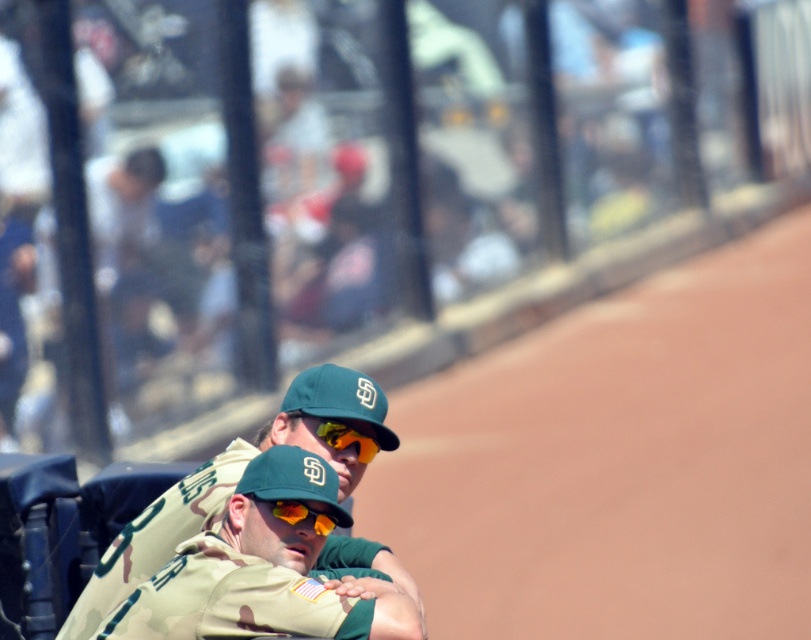
Question: Which object appears farthest from the camera in this image?

Choices:
 (A) camouflage uniform at center
 (B) shiny orange plastic goggles at center

Answer: (A)

Question: Can you confirm if camouflage uniform at center is positioned to the right of shiny orange plastic goggles at center?

Choices:
 (A) no
 (B) yes

Answer: (A)

Question: Which point is farther from the camera taking this photo?

Choices:
 (A) (367, 451)
 (B) (260, 432)

Answer: (B)

Question: Which object appears farthest from the camera in this image?

Choices:
 (A) shiny orange plastic goggles at center
 (B) shiny orange goggles at center

Answer: (B)

Question: Considering the relative positions of camouflage uniform at center and shiny orange plastic goggles at center in the image provided, where is camouflage uniform at center located with respect to shiny orange plastic goggles at center?

Choices:
 (A) left
 (B) right

Answer: (A)

Question: Can you confirm if camouflage uniform at center is positioned to the left of shiny orange plastic goggles at center?

Choices:
 (A) yes
 (B) no

Answer: (A)